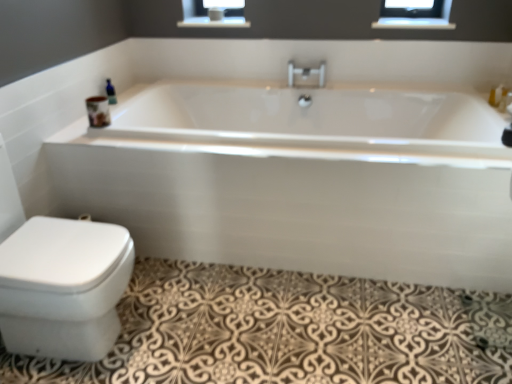
Question: Does clear glass balustrade at upper center appear on the left side of white glossy bathtub at center?

Choices:
 (A) no
 (B) yes

Answer: (A)

Question: Is clear glass balustrade at upper center not within white glossy bathtub at center?

Choices:
 (A) no
 (B) yes

Answer: (B)

Question: Can you confirm if clear glass balustrade at upper center is shorter than white glossy bathtub at center?

Choices:
 (A) yes
 (B) no

Answer: (A)

Question: Is clear glass balustrade at upper center positioned behind white glossy bathtub at center?

Choices:
 (A) no
 (B) yes

Answer: (B)

Question: From the image's perspective, is clear glass balustrade at upper center beneath white glossy bathtub at center?

Choices:
 (A) yes
 (B) no

Answer: (B)

Question: Would you consider clear glass balustrade at upper center to be distant from white glossy bathtub at center?

Choices:
 (A) no
 (B) yes

Answer: (B)

Question: Can you confirm if polished chrome faucet at center is shorter than white glossy bidet at lower left?

Choices:
 (A) yes
 (B) no

Answer: (A)

Question: From the image's perspective, is polished chrome faucet at center on top of white glossy bidet at lower left?

Choices:
 (A) no
 (B) yes

Answer: (B)

Question: From a real-world perspective, is polished chrome faucet at center beneath white glossy bidet at lower left?

Choices:
 (A) no
 (B) yes

Answer: (A)

Question: Are polished chrome faucet at center and white glossy bidet at lower left far apart?

Choices:
 (A) yes
 (B) no

Answer: (A)

Question: Does polished chrome faucet at center touch white glossy bidet at lower left?

Choices:
 (A) no
 (B) yes

Answer: (A)

Question: Does polished chrome faucet at center have a smaller size compared to white glossy bidet at lower left?

Choices:
 (A) yes
 (B) no

Answer: (A)

Question: Considering the relative sizes of white glossy bathtub at center and blue glass bottle at upper left in the image provided, is white glossy bathtub at center shorter than blue glass bottle at upper left?

Choices:
 (A) no
 (B) yes

Answer: (A)